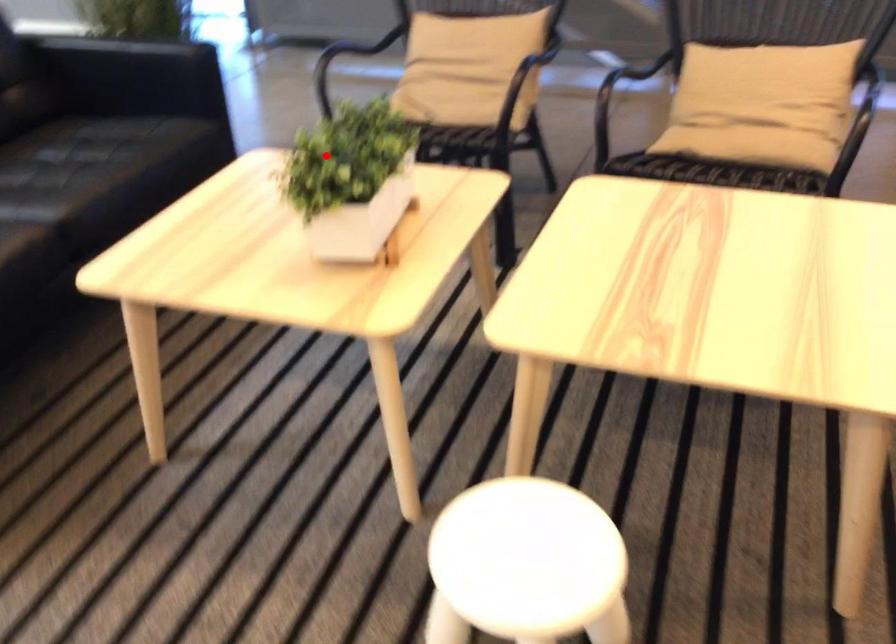
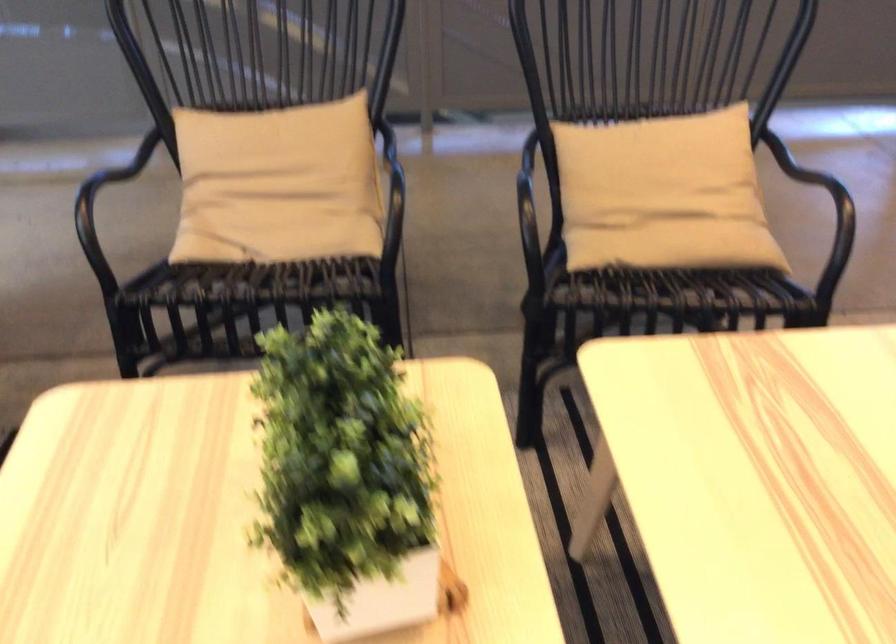
In the second image, find the point that corresponds to the highlighted location in the first image.

(346, 477)